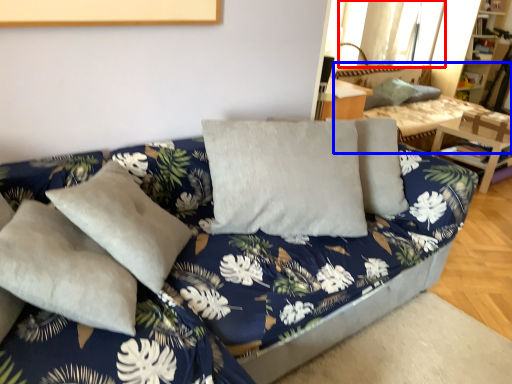
Question: Among these objects, which one is farthest to the camera, window (highlighted by a red box) or couch (highlighted by a blue box)?

Choices:
 (A) window
 (B) couch

Answer: (A)